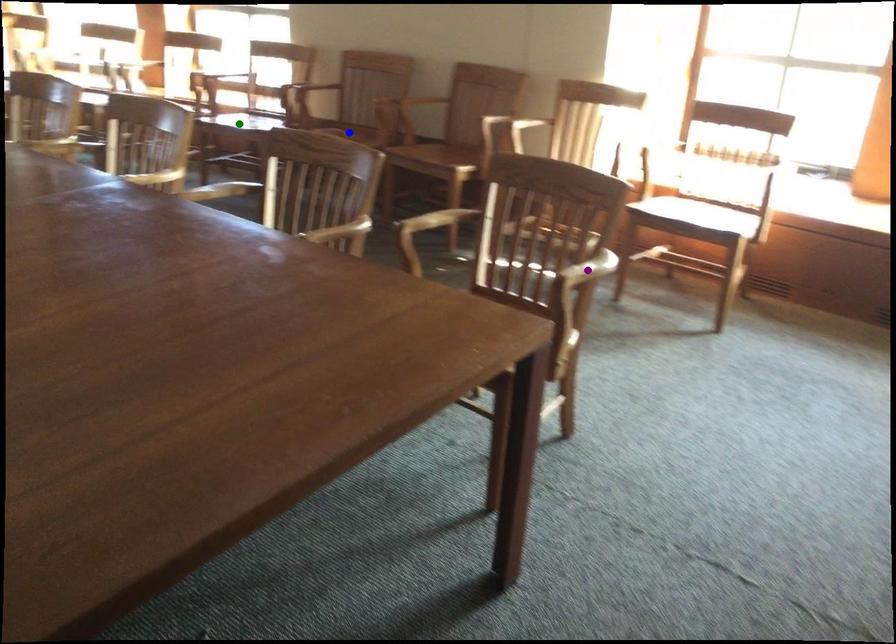
Order these from nearest to farthest:
purple point, green point, blue point

purple point, blue point, green point